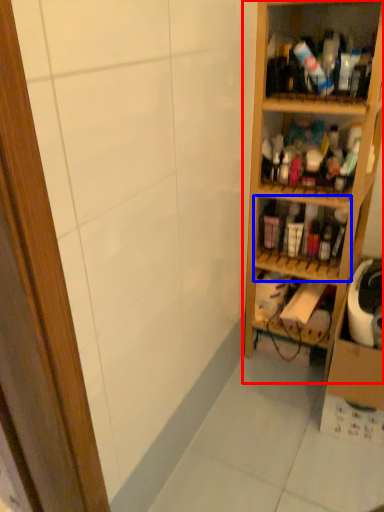
Question: Which of the following is the farthest to the observer, shelf (highlighted by a red box) or shelf (highlighted by a blue box)?

Choices:
 (A) shelf
 (B) shelf

Answer: (B)